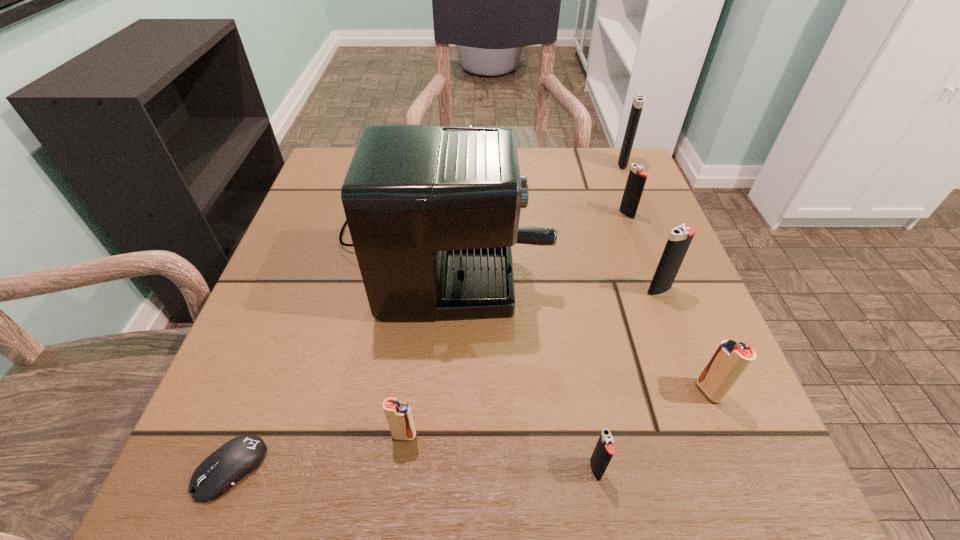
Where is `object that is positioned at the near left corner`? object that is positioned at the near left corner is located at coordinates (219, 472).

I want to click on object at the far right corner, so pyautogui.click(x=637, y=105).

The width and height of the screenshot is (960, 540). I want to click on blank space at the far edge of the desktop, so click(x=560, y=191).

Image resolution: width=960 pixels, height=540 pixels. In order to click on vacant space at the near edge of the desktop in this screenshot , I will do `click(546, 488)`.

Find the location of `vacant space at the left edge of the desktop`. vacant space at the left edge of the desktop is located at coordinates (333, 360).

Where is `vacant area at the near left corner of the desktop`? This screenshot has height=540, width=960. vacant area at the near left corner of the desktop is located at coordinates (189, 459).

In the image, there is a desktop. Identify the location of free space at the far right corner. Image resolution: width=960 pixels, height=540 pixels. (603, 150).

In the image, there is a desktop. Identify the location of free space at the near right corner. Image resolution: width=960 pixels, height=540 pixels. (702, 443).

This screenshot has height=540, width=960. Find the location of `free area in between the tallest object and the tallest igniter`. free area in between the tallest object and the tallest igniter is located at coordinates (532, 198).

Where is `free space between the computer equipment and the leftmost igniter`? This screenshot has height=540, width=960. free space between the computer equipment and the leftmost igniter is located at coordinates (318, 452).